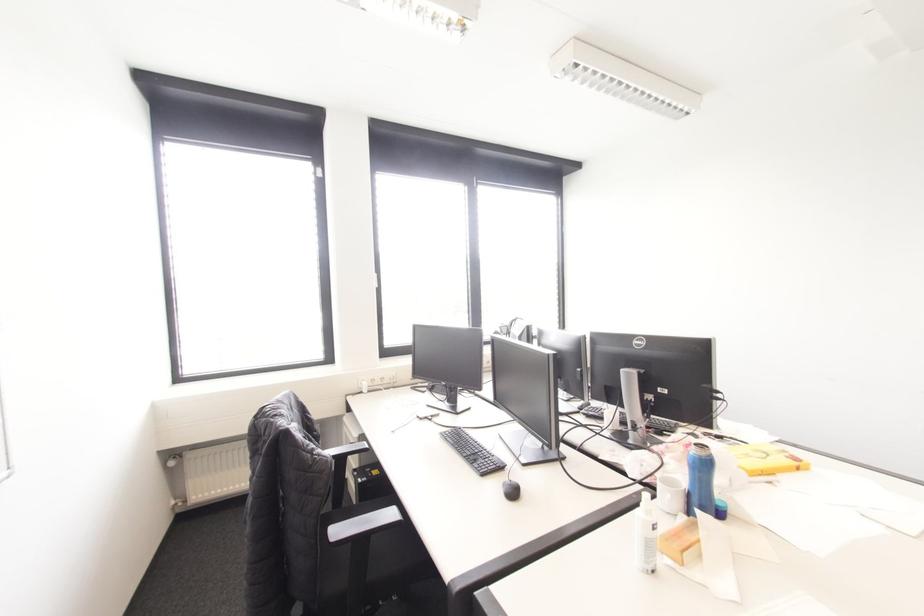
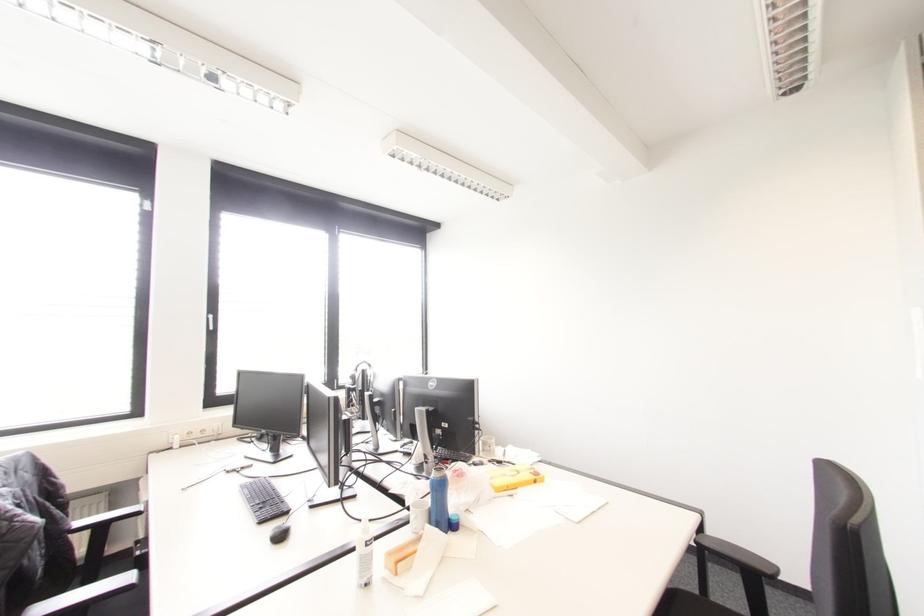
Where in the second image is the point corresponding to (329,454) from the first image?

(79, 523)